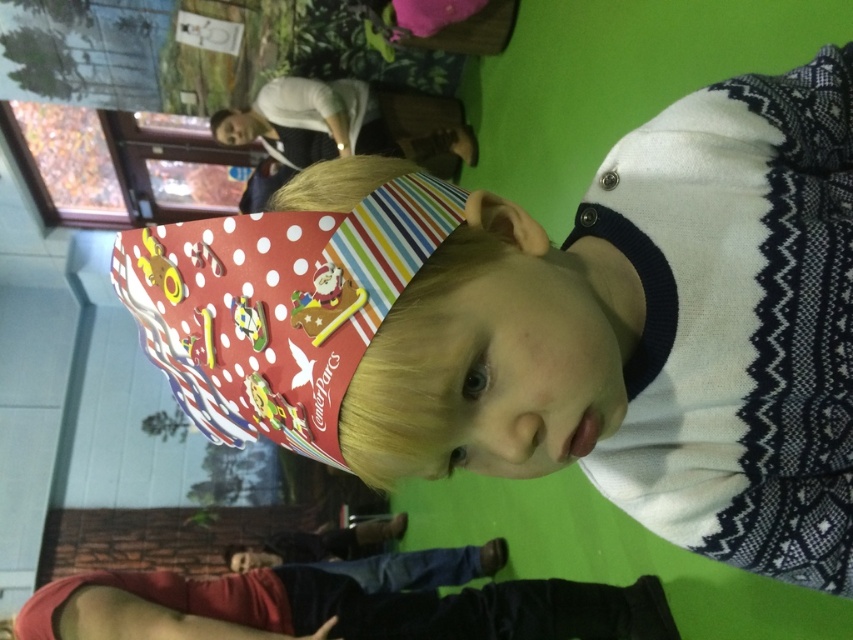
Question: Does denim pants at lower center have a smaller size compared to matte plastic head at center?

Choices:
 (A) yes
 (B) no

Answer: (B)

Question: Is denim pants at lower center below matte plastic head at upper center?

Choices:
 (A) no
 (B) yes

Answer: (B)

Question: Is denim pants at lower center positioned at the back of matte plastic head at center?

Choices:
 (A) yes
 (B) no

Answer: (B)

Question: Which object is the closest to the matte plastic head at upper center?

Choices:
 (A) matte plastic head at center
 (B) denim pants at lower center

Answer: (A)

Question: Which point is farther to the camera?

Choices:
 (A) denim pants at lower center
 (B) matte plastic head at center
 (C) matte plastic head at upper center

Answer: (C)

Question: Which point is closer to the camera taking this photo?

Choices:
 (A) (231, 556)
 (B) (270, 129)
 (C) (659, 612)

Answer: (C)